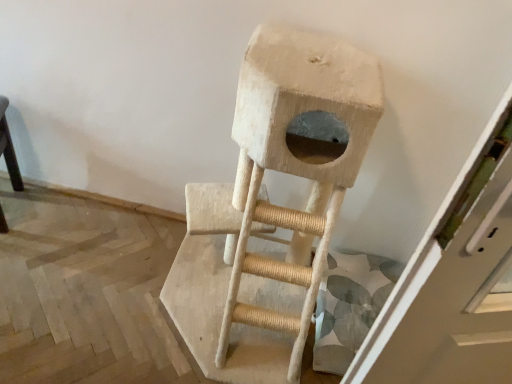
Where is `vacant space underneath smooth black table at left (from a real-world perspective)`? This screenshot has height=384, width=512. vacant space underneath smooth black table at left (from a real-world perspective) is located at coordinates (10, 207).